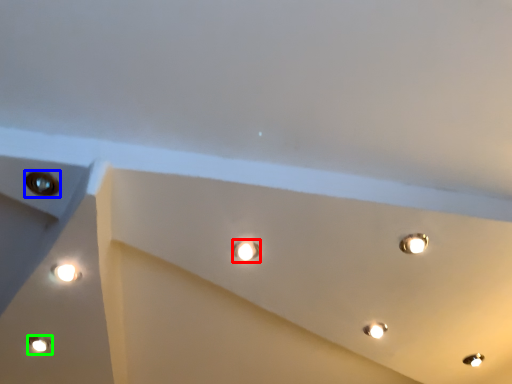
Question: Estimate the real-world distances between objects in this image. Which object is closer to droplight (highlighted by a red box), hole (highlighted by a blue box) or lamp (highlighted by a green box)?

Choices:
 (A) hole
 (B) lamp

Answer: (A)